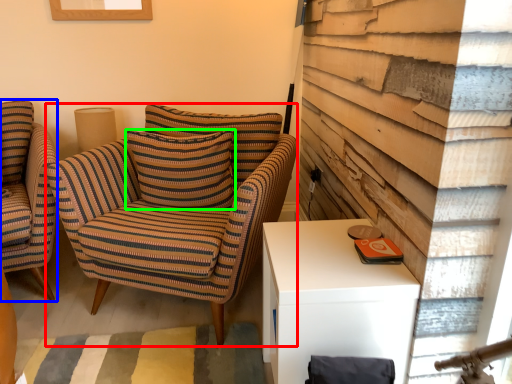
Question: Estimate the real-world distances between objects in this image. Which object is farther from chair (highlighted by a red box), chair (highlighted by a blue box) or pillow (highlighted by a green box)?

Choices:
 (A) chair
 (B) pillow

Answer: (A)